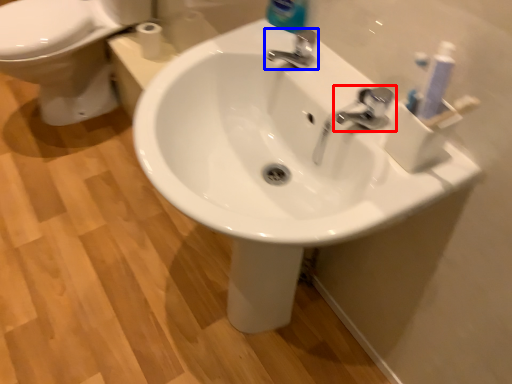
Question: Among these objects, which one is farthest to the camera, tap (highlighted by a red box) or tap (highlighted by a blue box)?

Choices:
 (A) tap
 (B) tap

Answer: (B)